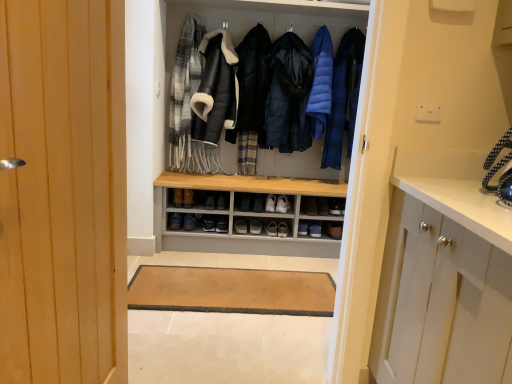
Question: From the image's perspective, is black quilted jacket at center, the 1th jacket positioned from the left, located beneath blue down jacket at center, marked as the 1th garment in a right-to-left arrangement?

Choices:
 (A) yes
 (B) no

Answer: (A)

Question: Can you confirm if black quilted jacket at center, the 1th jacket positioned from the left, is smaller than blue down jacket at center, acting as the second garment starting from the left?

Choices:
 (A) no
 (B) yes

Answer: (A)

Question: Does black quilted jacket at center, the 2th jacket positioned from the right, turn towards blue down jacket at center, marked as the 1th garment in a right-to-left arrangement?

Choices:
 (A) no
 (B) yes

Answer: (A)

Question: Is black quilted jacket at center, the 1th jacket positioned from the left, positioned in front of blue down jacket at center, marked as the 1th garment in a right-to-left arrangement?

Choices:
 (A) no
 (B) yes

Answer: (A)

Question: From the image's perspective, is black quilted jacket at center, the 1th jacket positioned from the left, on blue down jacket at center, marked as the 1th garment in a right-to-left arrangement?

Choices:
 (A) no
 (B) yes

Answer: (A)

Question: From the image's perspective, relative to blue down jacket at center, acting as the second garment starting from the left, is black quilted jacket at center, the 1th jacket positioned from the left, above or below?

Choices:
 (A) above
 (B) below

Answer: (B)

Question: From a real-world perspective, relative to blue down jacket at center, marked as the 1th garment in a right-to-left arrangement, is black quilted jacket at center, the 2th jacket positioned from the right, vertically above or below?

Choices:
 (A) above
 (B) below

Answer: (B)

Question: Based on their sizes in the image, would you say black quilted jacket at center, the 2th jacket positioned from the right, is bigger or smaller than blue down jacket at center, marked as the 1th garment in a right-to-left arrangement?

Choices:
 (A) small
 (B) big

Answer: (B)

Question: In terms of height, does black quilted jacket at center, the 1th jacket positioned from the left, look taller or shorter compared to blue down jacket at center, marked as the 1th garment in a right-to-left arrangement?

Choices:
 (A) tall
 (B) short

Answer: (A)

Question: Based on their positions, is black leather shoe at center, arranged as the fourth footwear when viewed from the right, located to the left or right of matte black shoe at center, arranged as the fourth footwear when viewed from the left?

Choices:
 (A) left
 (B) right

Answer: (A)

Question: Considering the positions of black leather shoe at center, the 3th footwear from the left, and matte black shoe at center, the third footwear when ordered from right to left, in the image, is black leather shoe at center, the 3th footwear from the left, bigger or smaller than matte black shoe at center, the third footwear when ordered from right to left,?

Choices:
 (A) small
 (B) big

Answer: (A)

Question: Is point (242, 225) positioned closer to the camera than point (252, 231)?

Choices:
 (A) closer
 (B) farther

Answer: (B)

Question: Do you think black leather shoe at center, arranged as the fourth footwear when viewed from the right, is within matte black shoe at center, arranged as the fourth footwear when viewed from the left, or outside of it?

Choices:
 (A) outside
 (B) inside

Answer: (A)

Question: Is black quilted jacket at center, the 1th jacket positioned from the left, to the left or to the right of leather jacket at center, which is the 1th garment in left-to-right order, in the image?

Choices:
 (A) right
 (B) left

Answer: (A)

Question: In terms of size, does black quilted jacket at center, the 2th jacket positioned from the right, appear bigger or smaller than leather jacket at center, which is the second garment in right-to-left order?

Choices:
 (A) small
 (B) big

Answer: (A)